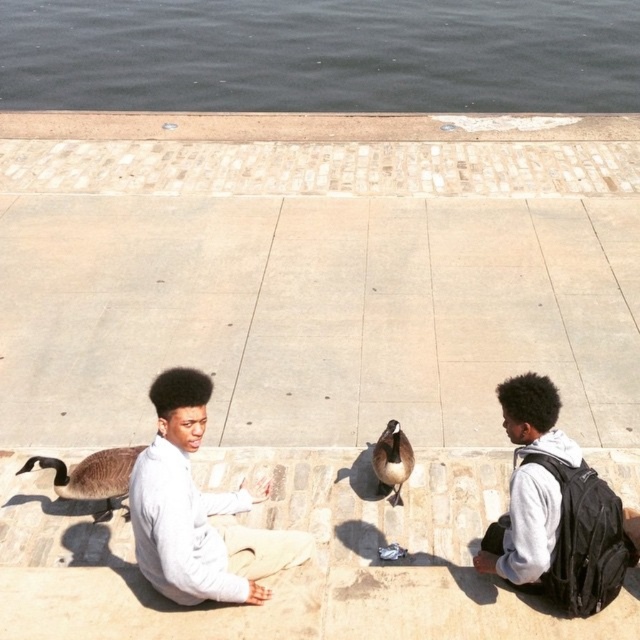
Question: Is brown matte duck at lower left closer to camera compared to brown feathered duck at center?

Choices:
 (A) no
 (B) yes

Answer: (B)

Question: Which of the following is the closest to the observer?

Choices:
 (A) dark gray water at upper center
 (B) brown matte duck at lower left
 (C) white matte jacket at center

Answer: (C)

Question: Can you confirm if gray fleece hoodie at right is positioned above brown feathered duck at center?

Choices:
 (A) yes
 (B) no

Answer: (A)

Question: Among these points, which one is farthest from the camera?

Choices:
 (A) (138, 65)
 (B) (493, 554)
 (C) (406, 460)
 (D) (138, 545)

Answer: (A)

Question: Where is dark gray water at upper center located in relation to white matte jacket at center in the image?

Choices:
 (A) below
 (B) above

Answer: (B)

Question: Which object is farther from the camera taking this photo?

Choices:
 (A) brown feathered duck at center
 (B) dark gray water at upper center

Answer: (B)